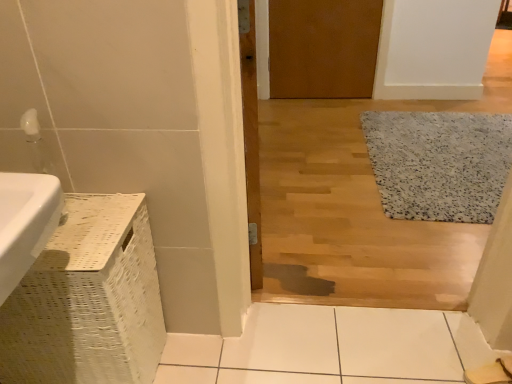
You are a GUI agent. You are given a task and a screenshot of the screen. Output one action in this format:
    pyautogui.click(x=<x>, y=<y>)
    Task: Click on the free space to the left of brown matte door at upper center, the 1th door positioned from the right
    This screenshot has height=384, width=512.
    Given the screenshot: What is the action you would take?
    pyautogui.click(x=289, y=107)